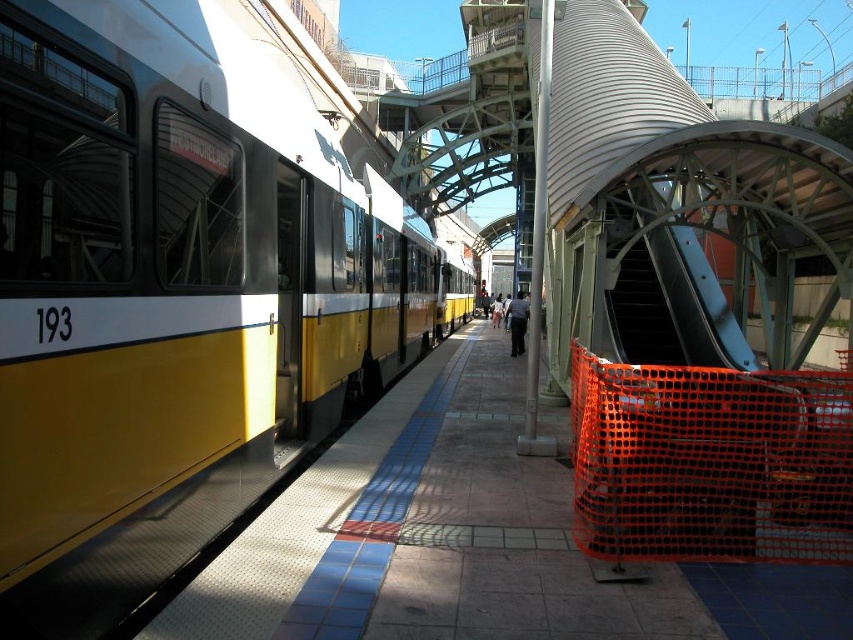
Consider the image. You are a passenger waiting at the station and see the yellow matte train at left and the black uniform at center. Which object is located to the left of the other?

The yellow matte train at left is positioned on the left side of black uniform at center.

You are a passenger waiting at the station. You notice the yellow matte train at left and the black uniform at center. Which object is taller?

The yellow matte train at left is much taller than the black uniform at center.

You are a passenger waiting at the station and see the yellow matte train at left and the black uniform at center. Which object is closer to you as you stand on the platform?

The yellow matte train at left is closer to you because it is in front of the black uniform at center.